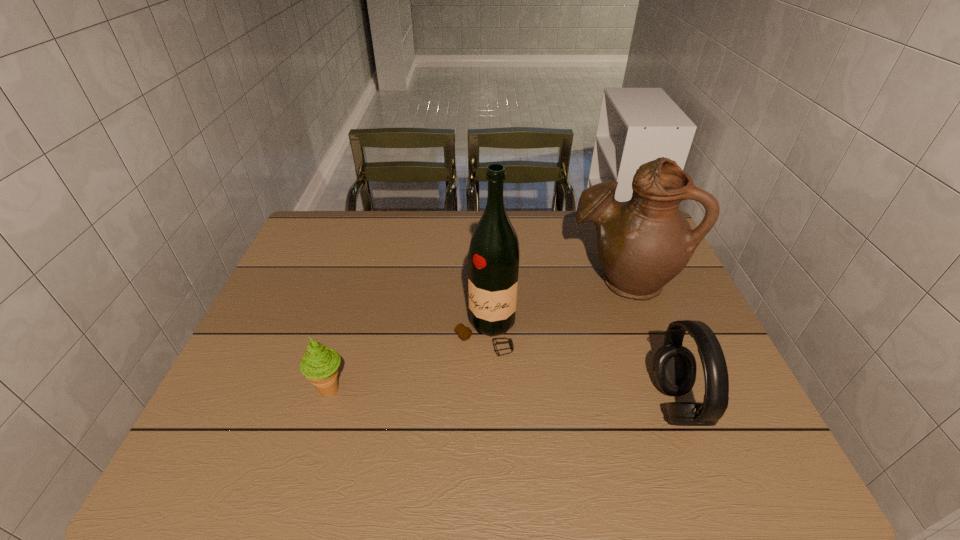
This screenshot has height=540, width=960. Find the location of `vacant space on the desktop that is between the icecream and the headset and is positioned at the spout of the pitcher`. vacant space on the desktop that is between the icecream and the headset and is positioned at the spout of the pitcher is located at coordinates (484, 396).

Locate an element on the screen. The height and width of the screenshot is (540, 960). free space on the desktop that is between the leftmost object and the headset and is positioned on the surface of the wine bottle is located at coordinates (450, 394).